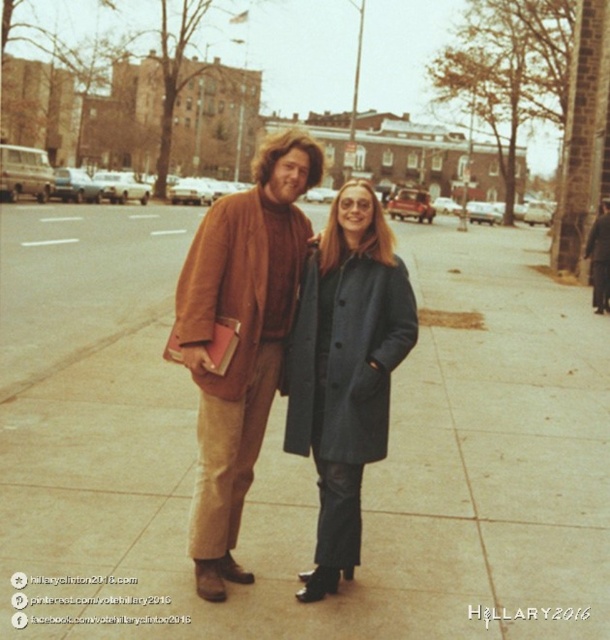
Question: Which of the following is the farthest from the observer?

Choices:
 (A) dark gray wool coat at center
 (B) slate gray concrete sidewalk at center
 (C) matte brown jacket at center

Answer: (A)

Question: Is slate gray concrete sidewalk at center to the right of dark gray wool coat at center from the viewer's perspective?

Choices:
 (A) yes
 (B) no

Answer: (B)

Question: From the image, what is the correct spatial relationship of slate gray concrete sidewalk at center in relation to matte brown jacket at center?

Choices:
 (A) below
 (B) above

Answer: (B)

Question: Which point is farther from the camera taking this photo?

Choices:
 (A) (295, 163)
 (B) (589, 540)

Answer: (B)

Question: Which of the following is the farthest from the observer?

Choices:
 (A) (465, 301)
 (B) (314, 310)
 (C) (273, 195)

Answer: (A)

Question: Does slate gray concrete sidewalk at center appear over matte brown jacket at center?

Choices:
 (A) no
 (B) yes

Answer: (B)